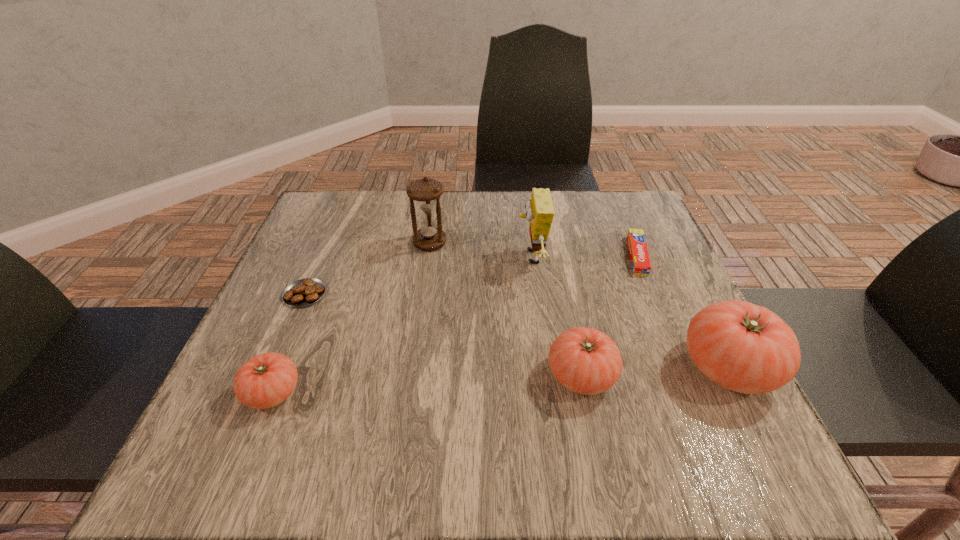
Identify the location of free space between the sponge and the fifth tallest object. (402, 325).

Locate an element on the screen. empty space that is in between the second tomato from right to left and the rightmost tomato is located at coordinates (655, 372).

Identify the location of free spot between the pastry and the fifth object from right to left. The image size is (960, 540). (368, 268).

What are the coordinates of `vacant point located between the pastry and the leftmost tomato` in the screenshot? It's located at (289, 343).

At what (x,y) coordinates should I click in order to perform the action: click on vacant area between the hourglass and the second tallest tomato. Please return your answer as a coordinate pair (x, y). This screenshot has width=960, height=540. Looking at the image, I should click on (505, 309).

Find the location of a particular element. This screenshot has width=960, height=540. free space between the toothpaste and the sponge is located at coordinates (584, 256).

Locate an element on the screen. The height and width of the screenshot is (540, 960). free point between the fifth shortest object and the third shortest object is located at coordinates (500, 380).

Identify which object is located as the fourth nearest to the toothpaste. Please provide its 2D coordinates. Your answer should be formatted as a tuple, i.e. [(x, y)], where the tuple contains the x and y coordinates of a point satisfying the conditions above.

[(426, 192)]

The height and width of the screenshot is (540, 960). In order to click on object that stands as the fourth closest to the hourglass in this screenshot , I will do `click(266, 380)`.

This screenshot has height=540, width=960. Identify the location of tomato that is the nearest to the fifth tallest object. (586, 361).